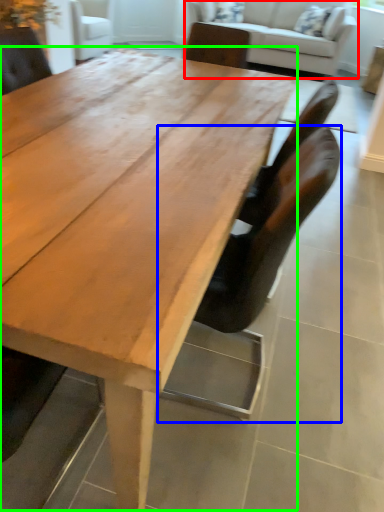
Question: Estimate the real-world distances between objects in this image. Which object is farther from studio couch (highlighted by a red box), chair (highlighted by a blue box) or coffee table (highlighted by a green box)?

Choices:
 (A) chair
 (B) coffee table

Answer: (A)